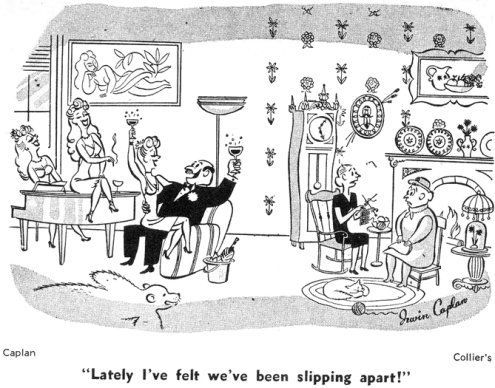
Where is `grandfather clock`? The width and height of the screenshot is (495, 388). grandfather clock is located at coordinates (316, 152).